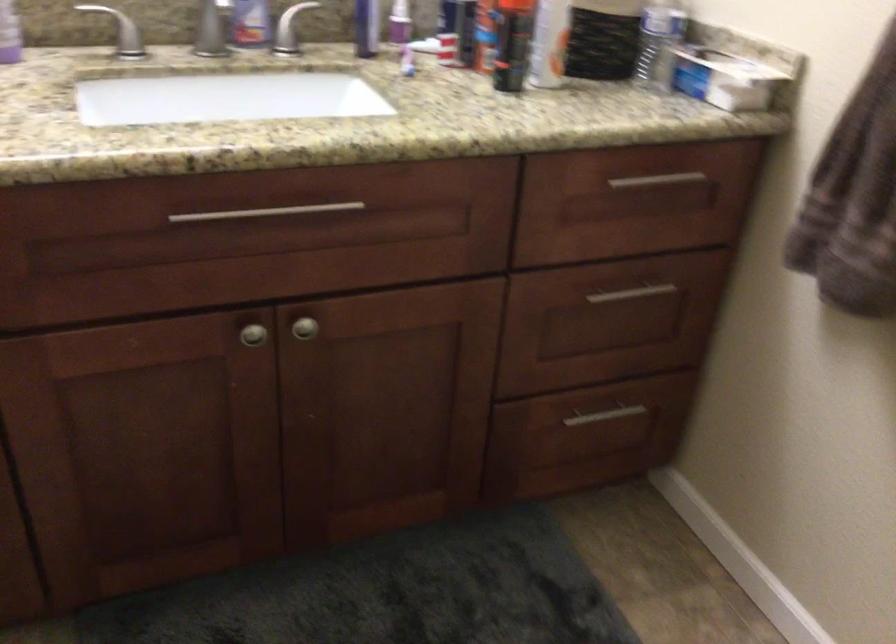
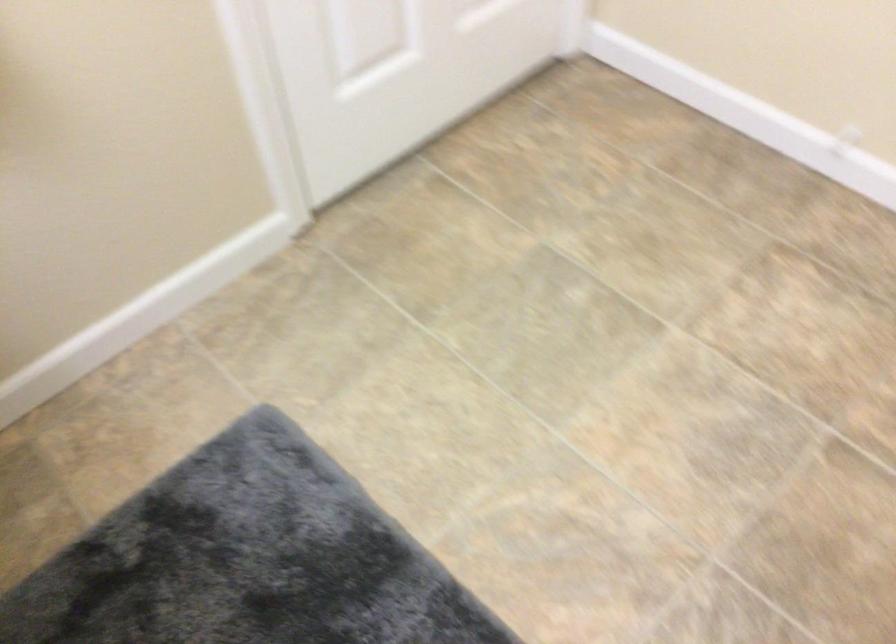
The images are taken continuously from a first-person perspective. In which direction is your viewpoint rotating?

The rotation direction of the camera is right-down.